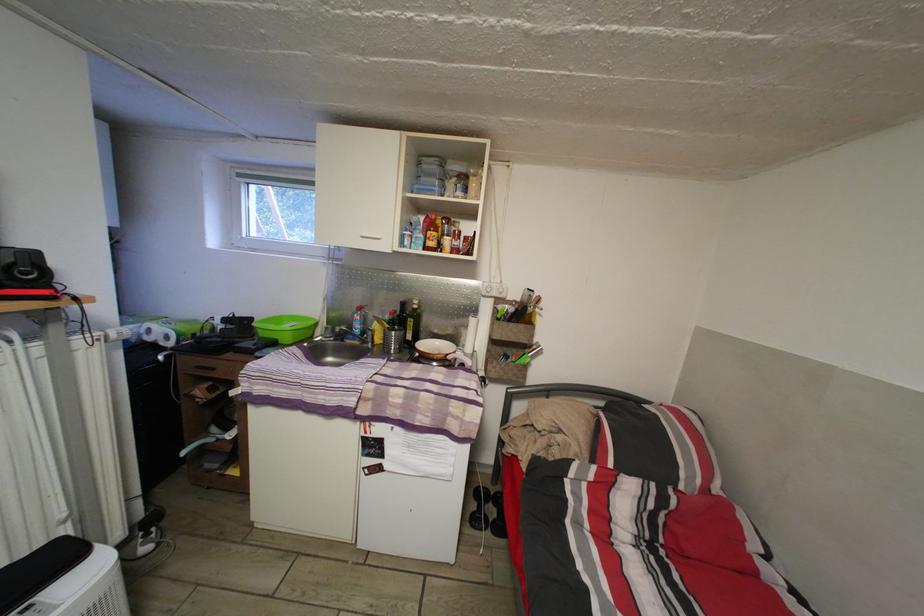
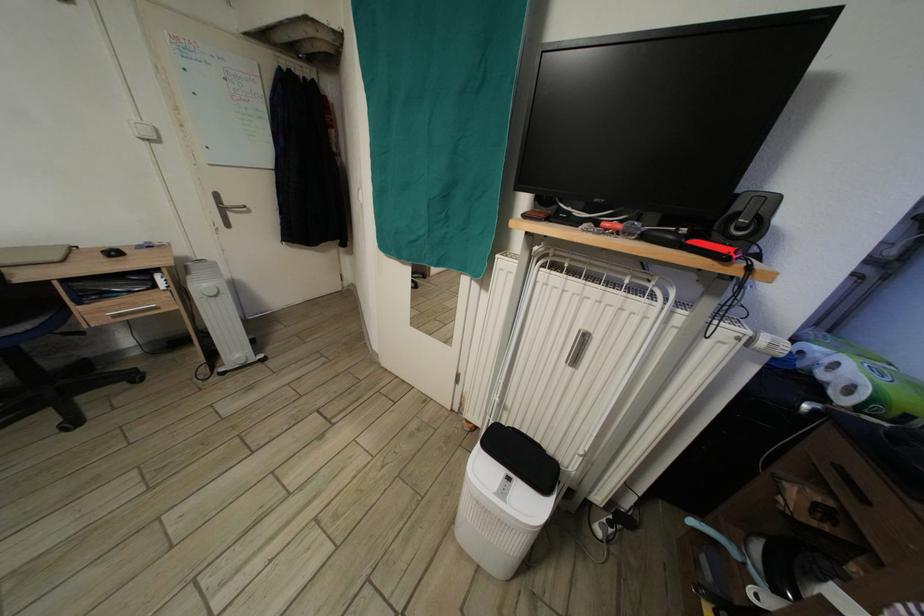
First-person continuous shooting, in which direction is the camera rotating?

The camera's rotation is toward left-down.